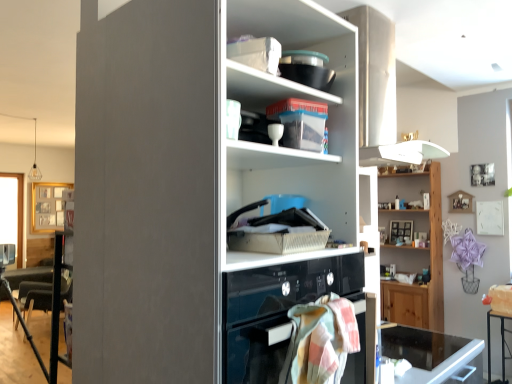
Question: Considering the positions of black glass desk at lower right and pastel plaid towel at lower center in the image, is black glass desk at lower right wider or thinner than pastel plaid towel at lower center?

Choices:
 (A) wide
 (B) thin

Answer: (A)

Question: Is black glass desk at lower right inside the boundaries of pastel plaid towel at lower center, or outside?

Choices:
 (A) outside
 (B) inside

Answer: (A)

Question: Estimate the real-world distances between objects in this image. Which object is farther from the pastel plaid towel at lower center?

Choices:
 (A) translucent plastic container at upper center, which is the second shelf in right-to-left order
 (B) black glass desk at lower right
 (C) white glossy cupboard at center
 (D) wooden shelf at upper right, which is the 1th shelf in back-to-front order

Answer: (D)

Question: Which is farther from the pastel plaid towel at lower center?

Choices:
 (A) white glossy cupboard at center
 (B) translucent plastic container at upper center, which is the second shelf in right-to-left order
 (C) wooden shelf at upper right, which is the second shelf from left to right
 (D) black glass desk at lower right

Answer: (C)